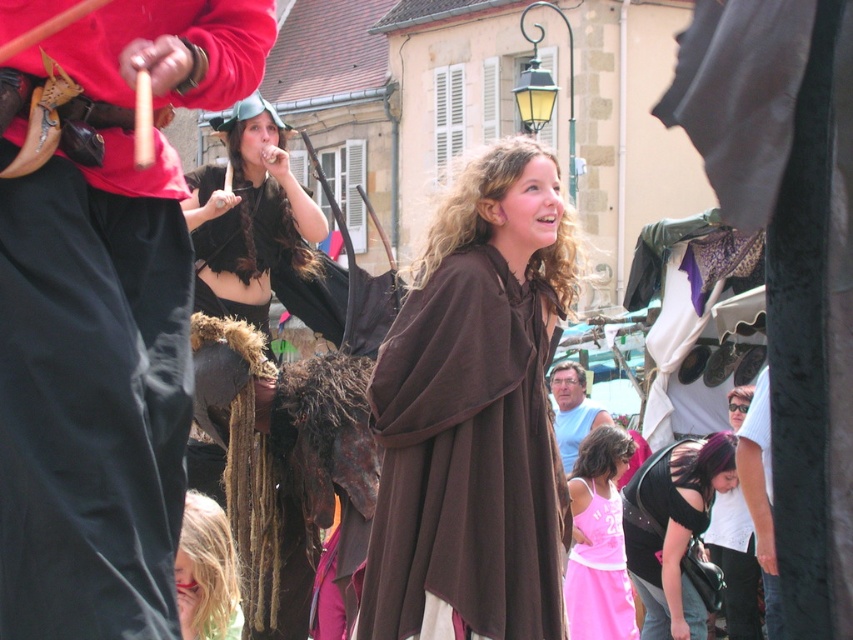
Which is below, white cotton shirt at lower right or light blue cotton shirt at center?

white cotton shirt at lower right

Does white cotton shirt at lower right have a larger size compared to light blue cotton shirt at center?

No, white cotton shirt at lower right is not bigger than light blue cotton shirt at center.

What do you see at coordinates (735, 564) in the screenshot? This screenshot has width=853, height=640. I see `white cotton shirt at lower right` at bounding box center [735, 564].

At what (x,y) coordinates should I click in order to perform the action: click on white cotton shirt at lower right. Please return your answer as a coordinate pair (x, y). This screenshot has height=640, width=853. Looking at the image, I should click on (735, 564).

Is matte black pants at left below brown soft fabric cape at center?

Incorrect, matte black pants at left is not positioned below brown soft fabric cape at center.

Is matte black pants at left thinner than brown soft fabric cape at center?

Indeed, matte black pants at left has a lesser width compared to brown soft fabric cape at center.

Is point (70, 218) positioned before point (445, 573)?

Yes.

Where is `matte black pants at left`? This screenshot has height=640, width=853. matte black pants at left is located at coordinates (102, 314).

Between matte black pants at left and light blue cotton shirt at center, which one is positioned higher?

matte black pants at left is above.

What do you see at coordinates (102, 314) in the screenshot?
I see `matte black pants at left` at bounding box center [102, 314].

Where is `matte black pants at left`? Image resolution: width=853 pixels, height=640 pixels. matte black pants at left is located at coordinates (102, 314).